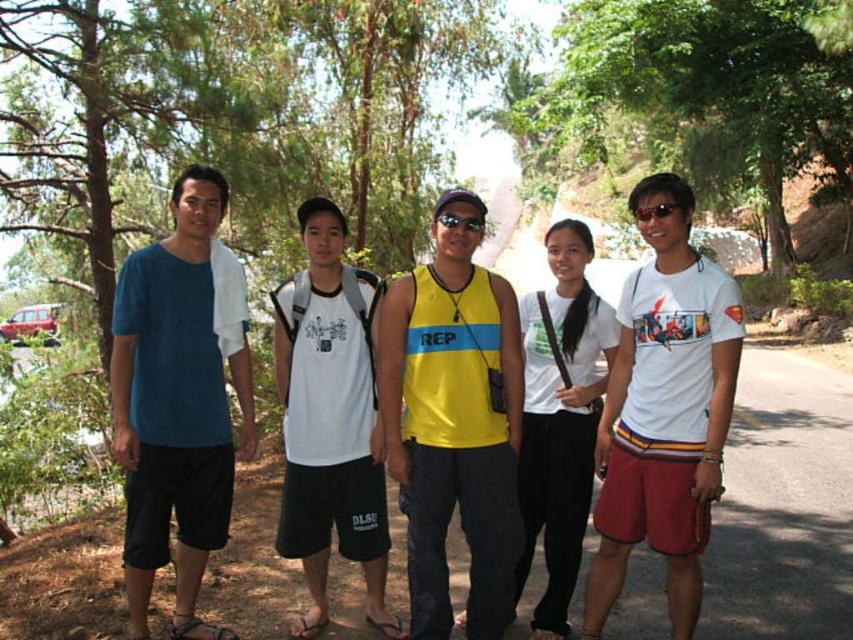
Question: Which is nearer to the yellow matte tank top at center?

Choices:
 (A) white cotton t-shirt at right
 (B) matte blue t-shirt at left

Answer: (A)

Question: Can you confirm if sunglasses at center is bigger than matte black sunglasses at center?

Choices:
 (A) no
 (B) yes

Answer: (B)

Question: Which object is farther from the camera taking this photo?

Choices:
 (A) matte blue t-shirt at left
 (B) green leafy tree at upper center
 (C) white matte tank top at center
 (D) sunglasses at center

Answer: (B)

Question: Which point is closer to the camera?

Choices:
 (A) (637, 209)
 (B) (196, 560)
 (C) (311, 513)
 (D) (462, 314)

Answer: (A)

Question: Does yellow matte tank top at center come behind sunglasses at center?

Choices:
 (A) no
 (B) yes

Answer: (B)

Question: Is green leafy tree at upper center positioned behind white matte tank top at center?

Choices:
 (A) no
 (B) yes

Answer: (B)